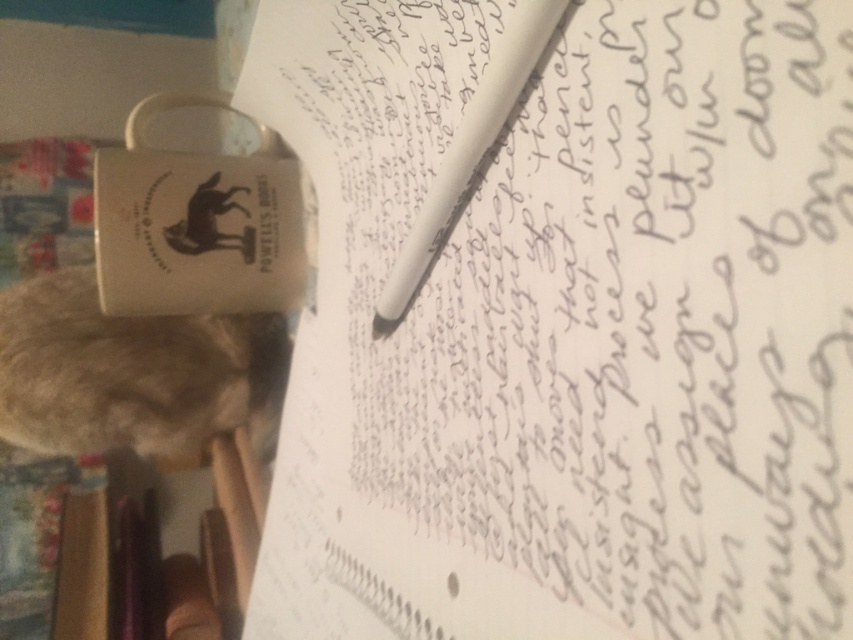
Where is the white paper at center located in the image?

The white paper at center is located at point coordinates of 0.514 on the x axis and 0.668 on the y axis.

Consider the image. What is located at the coordinates point (569,328) in the image?

The white paper at center is located at point (569,328).